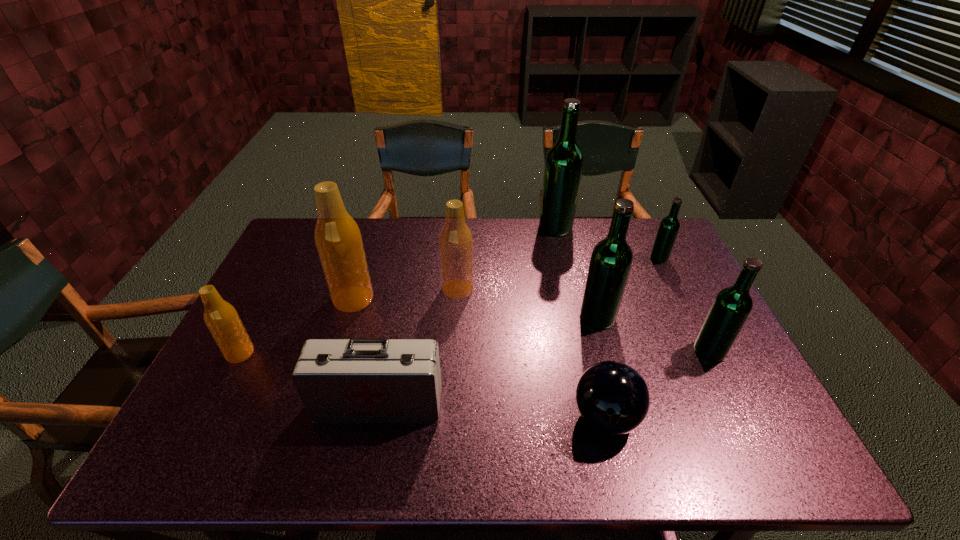
At what (x,y) coordinates should I click in order to perform the action: click on free spot between the farthest beer bottle and the smallest tan beer bottle. Please return your answer as a coordinate pair (x, y). This screenshot has height=540, width=960. Looking at the image, I should click on (398, 290).

Identify which object is the fourth nearest to the second biggest green beer bottle. Please provide its 2D coordinates. Your answer should be formatted as a tuple, i.e. [(x, y)], where the tuple contains the x and y coordinates of a point satisfying the conditions above.

[(455, 241)]

At what (x,y) coordinates should I click in order to perform the action: click on object that is the second closest to the shortest object. Please return your answer as a coordinate pair (x, y). This screenshot has width=960, height=540. Looking at the image, I should click on (731, 307).

Identify which beer bottle is the seventh nearest to the shortest object. Please provide its 2D coordinates. Your answer should be formatted as a tuple, i.e. [(x, y)], where the tuple contains the x and y coordinates of a point satisfying the conditions above.

[(221, 318)]

This screenshot has height=540, width=960. What are the coordinates of `the second closest beer bottle to the nearest green beer bottle` in the screenshot? It's located at (669, 226).

At what (x,y) coordinates should I click in order to perform the action: click on green beer bottle that stands as the fourth closest to the black bowling ball. Please return your answer as a coordinate pair (x, y). Looking at the image, I should click on (564, 161).

I want to click on green beer bottle that stands as the second closest to the third biggest green beer bottle, so click(669, 226).

Find the location of a particular element. the closest tan beer bottle relative to the first-aid kit is located at coordinates (221, 318).

Where is `tan beer bottle that stands as the closest to the second tan beer bottle from left to right`? tan beer bottle that stands as the closest to the second tan beer bottle from left to right is located at coordinates (221, 318).

Locate an element on the screen. The width and height of the screenshot is (960, 540). free space that satisfies the following two spatial constraints: 1. on the back side of the nearest tan beer bottle; 2. on the right side of the third beer bottle from left to right is located at coordinates (274, 289).